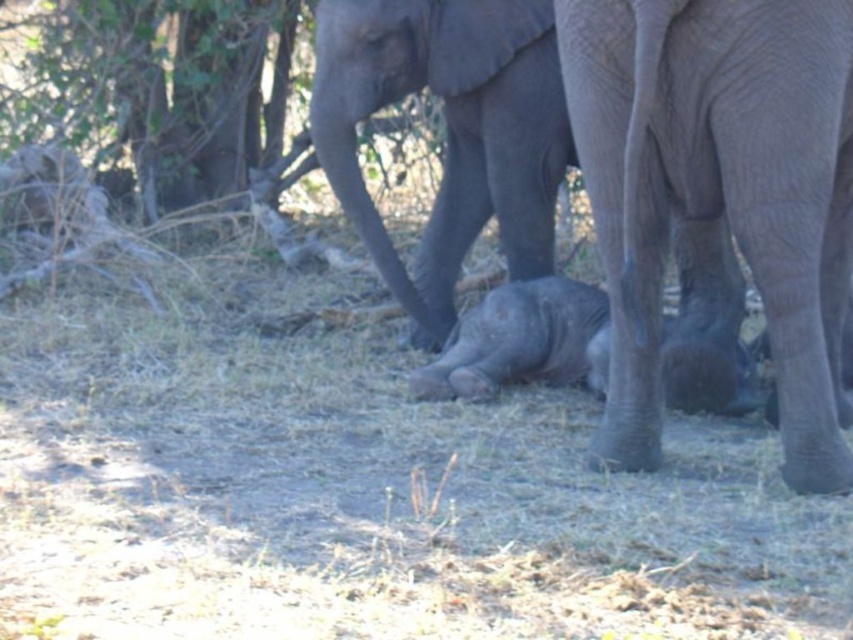
You are a wildlife photographer trying to capture a closeup of the gray matte elephant at center and the green leafy tree at upper left in the same frame. Based on their sizes, which one should you focus on first to ensure both are in the shot?

The gray matte elephant at center has a smaller size compared to green leafy tree at upper left, so you should focus on the gray matte elephant at center first to ensure both are in the shot.

You are standing in the savanna and see the gray textured elephant at center. If you want to approach it without disturbing it, what is the minimum safe distance you should maintain?

The gray textured elephant at center and viewer are 13.68 feet apart, so the minimum safe distance to maintain is 13.68 feet to avoid disturbing it.

You are an observer in the savanna. You see the gray matte elephant at center and the green leafy tree at upper left. Which object is positioned more to the east if the sun is setting in the west?

The gray matte elephant at center is positioned more to the east because it is to the right of the green leafy tree at upper left, and since the sun is setting in the west, the right side of the image corresponds to the east direction.